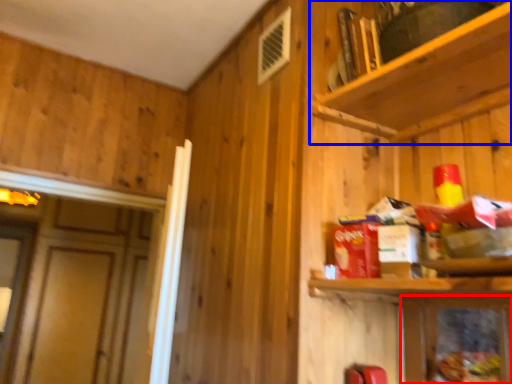
Question: Among these objects, which one is farthest to the camera, cabinetry (highlighted by a red box) or shelf (highlighted by a blue box)?

Choices:
 (A) cabinetry
 (B) shelf

Answer: (A)